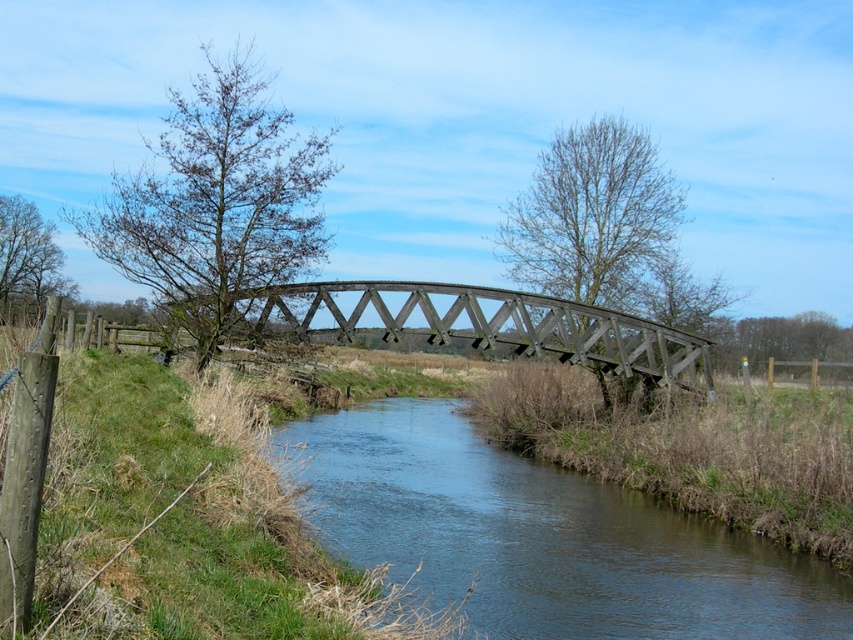
Question: Which point is farther to the camera?

Choices:
 (A) (451, 410)
 (B) (341, 298)

Answer: (A)

Question: Can you confirm if dark brown water at center is positioned above dark brown wooden bridge at center?

Choices:
 (A) yes
 (B) no

Answer: (B)

Question: Can you confirm if dark brown water at center is positioned below dark brown wooden bridge at center?

Choices:
 (A) yes
 (B) no

Answer: (A)

Question: Which point is farther to the camera?

Choices:
 (A) (350, 440)
 (B) (508, 314)

Answer: (A)

Question: Does dark brown water at center have a larger size compared to dark brown wooden bridge at center?

Choices:
 (A) yes
 (B) no

Answer: (A)

Question: Which point is farther to the camera?

Choices:
 (A) (450, 516)
 (B) (553, 307)

Answer: (B)